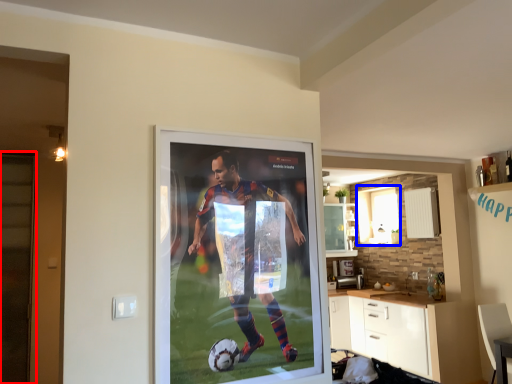
Question: Among these objects, which one is farthest to the camera, screen door (highlighted by a red box) or window (highlighted by a blue box)?

Choices:
 (A) screen door
 (B) window

Answer: (B)